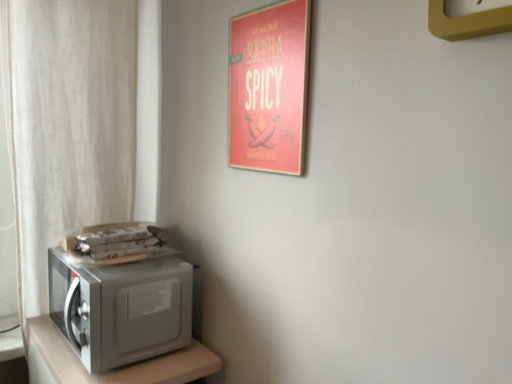
Question: Is satin silver microwave at lower left shorter than satin silver microwave at left?

Choices:
 (A) yes
 (B) no

Answer: (A)

Question: Is satin silver microwave at lower left directly adjacent to satin silver microwave at left?

Choices:
 (A) yes
 (B) no

Answer: (B)

Question: Does satin silver microwave at lower left appear on the left side of satin silver microwave at left?

Choices:
 (A) yes
 (B) no

Answer: (B)

Question: Can you confirm if satin silver microwave at lower left is thinner than satin silver microwave at left?

Choices:
 (A) no
 (B) yes

Answer: (B)

Question: Is satin silver microwave at lower left outside satin silver microwave at left?

Choices:
 (A) no
 (B) yes

Answer: (B)

Question: Considering the relative sizes of satin silver microwave at lower left and satin silver microwave at left in the image provided, is satin silver microwave at lower left smaller than satin silver microwave at left?

Choices:
 (A) yes
 (B) no

Answer: (A)

Question: Is white sheer curtain at left completely or partially inside yellow plastic clock at upper right?

Choices:
 (A) no
 (B) yes

Answer: (A)

Question: Would you say yellow plastic clock at upper right is outside white sheer curtain at left?

Choices:
 (A) yes
 (B) no

Answer: (A)

Question: Is yellow plastic clock at upper right in contact with white sheer curtain at left?

Choices:
 (A) yes
 (B) no

Answer: (B)

Question: From the image's perspective, is yellow plastic clock at upper right on white sheer curtain at left?

Choices:
 (A) yes
 (B) no

Answer: (A)

Question: Can you confirm if yellow plastic clock at upper right is smaller than white sheer curtain at left?

Choices:
 (A) no
 (B) yes

Answer: (B)

Question: Are yellow plastic clock at upper right and white sheer curtain at left far apart?

Choices:
 (A) no
 (B) yes

Answer: (B)

Question: Does satin silver microwave at lower left appear on the left side of yellow plastic clock at upper right?

Choices:
 (A) yes
 (B) no

Answer: (A)